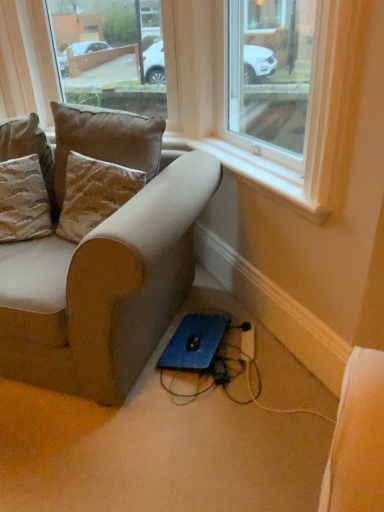
Question: Can you confirm if black plastic extension cord at lower center is taller than textured beige pillow at upper left, which is the second pillow from right to left?

Choices:
 (A) yes
 (B) no

Answer: (B)

Question: Is black plastic extension cord at lower center turned away from textured beige pillow at upper left, the first pillow in the left-to-right sequence?

Choices:
 (A) yes
 (B) no

Answer: (B)

Question: Does black plastic extension cord at lower center have a greater width compared to textured beige pillow at upper left, the first pillow in the left-to-right sequence?

Choices:
 (A) yes
 (B) no

Answer: (B)

Question: Is black plastic extension cord at lower center not within textured beige pillow at upper left, which is the second pillow from right to left?

Choices:
 (A) yes
 (B) no

Answer: (A)

Question: Considering the relative sizes of black plastic extension cord at lower center and textured beige pillow at upper left, which is the second pillow from right to left, in the image provided, is black plastic extension cord at lower center thinner than textured beige pillow at upper left, which is the second pillow from right to left,?

Choices:
 (A) yes
 (B) no

Answer: (A)

Question: Considering the relative sizes of black plastic extension cord at lower center and textured beige pillow at upper left, which is the second pillow from right to left, in the image provided, is black plastic extension cord at lower center bigger than textured beige pillow at upper left, which is the second pillow from right to left,?

Choices:
 (A) no
 (B) yes

Answer: (A)

Question: Is white plastic window sill at upper center positioned far away from black plastic extension cord at lower center?

Choices:
 (A) no
 (B) yes

Answer: (A)

Question: From the image's perspective, is white plastic window sill at upper center over black plastic extension cord at lower center?

Choices:
 (A) no
 (B) yes

Answer: (B)

Question: Is white plastic window sill at upper center turned away from black plastic extension cord at lower center?

Choices:
 (A) no
 (B) yes

Answer: (A)

Question: Is white plastic window sill at upper center next to black plastic extension cord at lower center and touching it?

Choices:
 (A) no
 (B) yes

Answer: (A)

Question: From a real-world perspective, is white plastic window sill at upper center positioned over black plastic extension cord at lower center based on gravity?

Choices:
 (A) no
 (B) yes

Answer: (B)

Question: From the image's perspective, is white plastic window sill at upper center under black plastic extension cord at lower center?

Choices:
 (A) no
 (B) yes

Answer: (A)

Question: Does textured beige pillow at upper left, the first pillow in the left-to-right sequence, have a greater height compared to white plastic window sill at upper center?

Choices:
 (A) yes
 (B) no

Answer: (A)